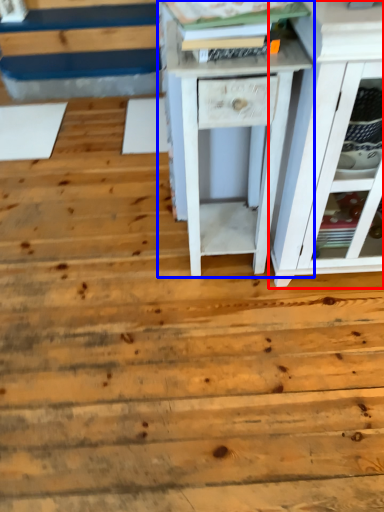
Question: Among these objects, which one is nearest to the camera, chest of drawers (highlighted by a red box) or nightstand (highlighted by a blue box)?

Choices:
 (A) chest of drawers
 (B) nightstand

Answer: (A)